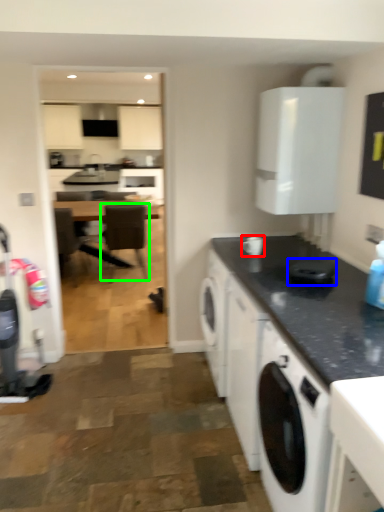
Question: Based on their relative distances, which object is nearer to appliance (highlighted by a red box)? Choose from appliance (highlighted by a blue box) and chair (highlighted by a green box).

Choices:
 (A) appliance
 (B) chair

Answer: (A)